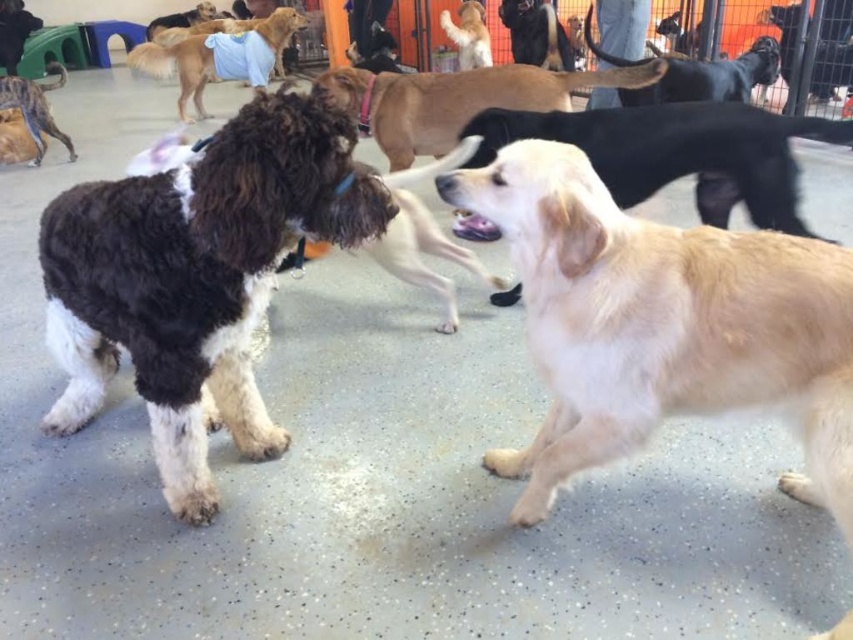
Question: Which point is farther from the camera taking this photo?

Choices:
 (A) [434, 120]
 (B) [488, 51]

Answer: (B)

Question: Is brown furry dog at center smaller than brown fur dog at upper left?

Choices:
 (A) no
 (B) yes

Answer: (A)

Question: Which object appears farthest from the camera in this image?

Choices:
 (A) golden smooth coat at right
 (B) golden fur dog at upper center

Answer: (B)

Question: Is golden smooth coat at right positioned at the back of golden fur dog at upper center?

Choices:
 (A) no
 (B) yes

Answer: (A)

Question: Does golden smooth coat at right appear under brown furry dog at center?

Choices:
 (A) yes
 (B) no

Answer: (A)

Question: Which of the following is the closest to the observer?

Choices:
 (A) golden fur dog at upper center
 (B) brown fur dog at upper left

Answer: (B)